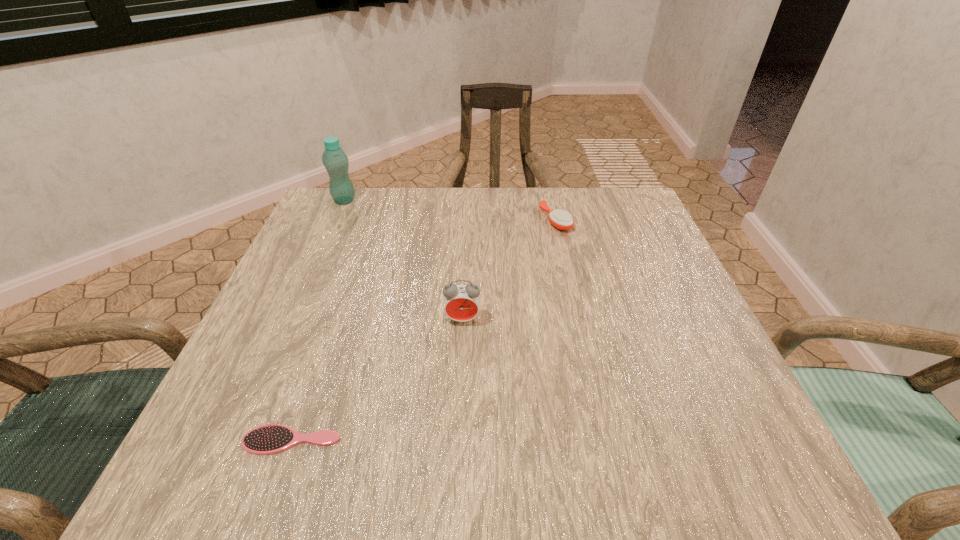
Locate an element on the screen. blank area located on the front of the rightmost object is located at coordinates click(x=564, y=261).

You are a GUI agent. You are given a task and a screenshot of the screen. Output one action in this format:
    pyautogui.click(x=<x>, y=<y>)
    Task: Click on the free space located 0.140m on the right of the nearest object
    
    Given the screenshot: What is the action you would take?
    pyautogui.click(x=436, y=440)

Where is `water bottle located in the far edge section of the desktop`? This screenshot has width=960, height=540. water bottle located in the far edge section of the desktop is located at coordinates (334, 159).

Where is `hairbrush that is at the far edge`? The height and width of the screenshot is (540, 960). hairbrush that is at the far edge is located at coordinates (560, 219).

You are a GUI agent. You are given a task and a screenshot of the screen. Output one action in this format:
    pyautogui.click(x=<x>, y=<y>)
    Task: Click on the object that is at the near edge
    The width and height of the screenshot is (960, 540).
    Given the screenshot: What is the action you would take?
    pyautogui.click(x=268, y=439)

Where is `water bottle that is at the left edge`? The height and width of the screenshot is (540, 960). water bottle that is at the left edge is located at coordinates (334, 159).

Where is `hairbrush at the left edge`? hairbrush at the left edge is located at coordinates (268, 439).

Where is `object that is at the far left corner`? The width and height of the screenshot is (960, 540). object that is at the far left corner is located at coordinates [x=334, y=159].

In order to click on object located in the near left corner section of the desktop in this screenshot , I will do `click(268, 439)`.

Identify the location of free space at the far edge of the desktop. Image resolution: width=960 pixels, height=540 pixels. (560, 241).